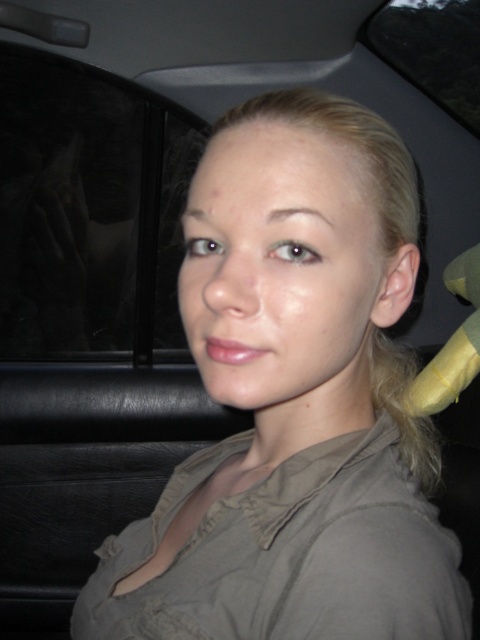
You are inside a car and want to reach a button located at point (392,29) while avoiding touching the seat at point (50,314). Which point is closer to you?

Point (50,314) is further to the viewer than point (392,29), so the button at point (392,29) is closer to you and you can reach it without touching the seat at point (50,314).

You are a passenger in the car and want to look outside. Which glass should you use to see the view above the seat? The transparent glass at left or the transparent glass window at upper center?

The transparent glass window at upper center is positioned above the transparent glass at left, so you should use the transparent glass window at upper center to see the view above the seat.